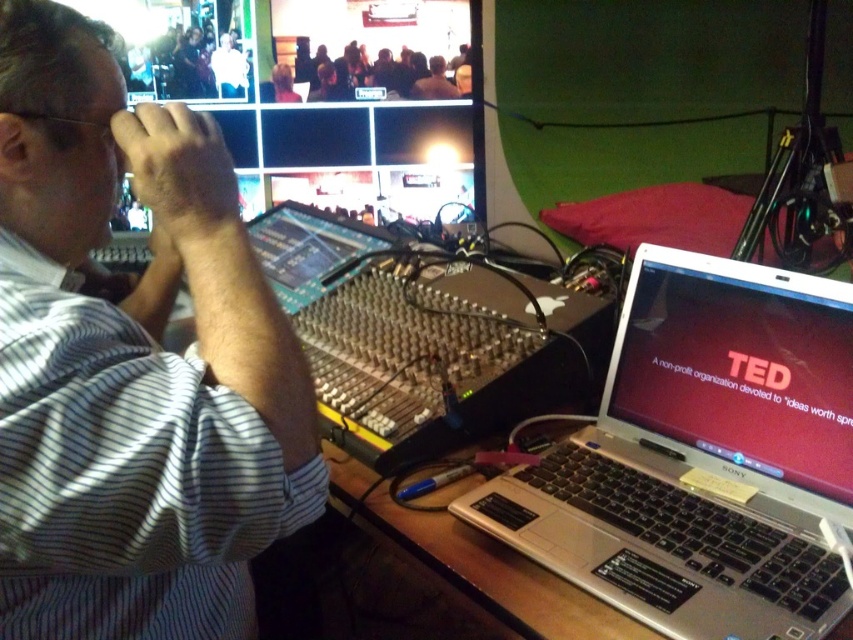
Question: Can you confirm if silver metallic laptop at right is positioned above wooden table at lower right?

Choices:
 (A) no
 (B) yes

Answer: (B)

Question: Which object is positioned farthest from the matte silver laptop at right?

Choices:
 (A) wooden table at lower right
 (B) white striped shirt at upper left

Answer: (B)

Question: Can you confirm if white striped shirt at upper left is bigger than silver metallic laptop at right?

Choices:
 (A) yes
 (B) no

Answer: (A)

Question: Estimate the real-world distances between objects in this image. Which object is farther from the white striped shirt at upper left?

Choices:
 (A) silver metallic laptop at right
 (B) wooden table at lower right
 (C) matte silver laptop at right

Answer: (C)

Question: Which is nearer to the white striped shirt at upper left?

Choices:
 (A) matte silver laptop at right
 (B) wooden table at lower right
 (C) silver metallic laptop at right

Answer: (B)

Question: Can you confirm if white striped shirt at upper left is positioned above wooden table at lower right?

Choices:
 (A) no
 (B) yes

Answer: (B)